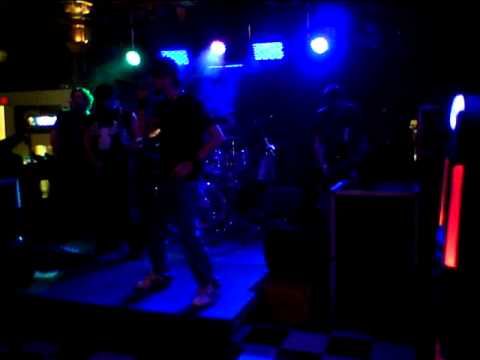
In order to click on stage in this screenshot , I will do `click(89, 298)`.